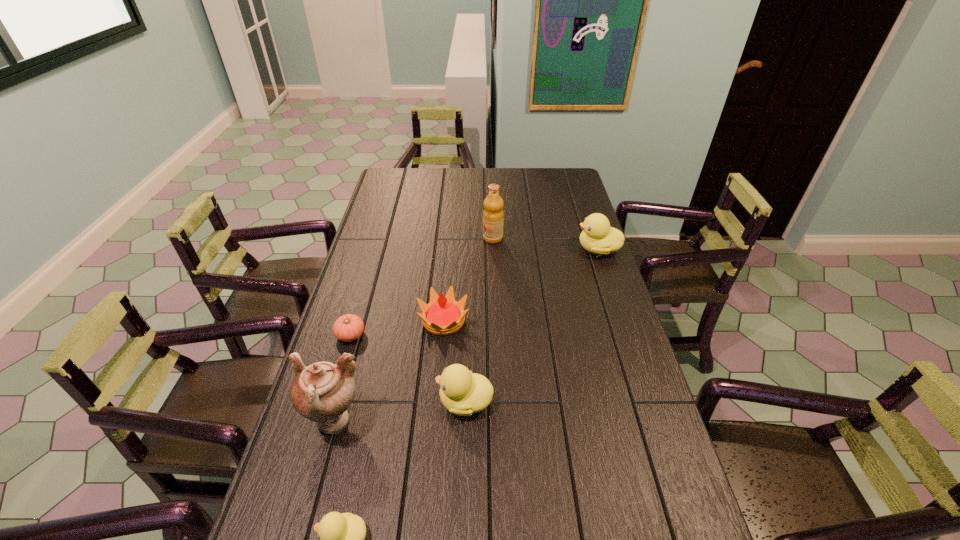
Locate an element on the screen. vacant space that is in between the urn and the rightmost duckling is located at coordinates (467, 336).

Where is `unoccupied position between the second tallest duckling and the urn`? unoccupied position between the second tallest duckling and the urn is located at coordinates (400, 411).

Find the location of a particular element. vacant region between the urn and the second tallest duckling is located at coordinates (400, 411).

Locate an element on the screen. Image resolution: width=960 pixels, height=540 pixels. free area in between the second farthest duckling and the rightmost object is located at coordinates (532, 325).

This screenshot has width=960, height=540. I want to click on free point between the urn and the fruit juice, so click(x=414, y=330).

You are a GUI agent. You are given a task and a screenshot of the screen. Output one action in this format:
    pyautogui.click(x=<x>, y=<y>)
    Task: Click on the vacant space that is in between the second tallest duckling and the fruit juice
    Image resolution: width=960 pixels, height=540 pixels.
    Given the screenshot: What is the action you would take?
    pyautogui.click(x=479, y=320)

Locate an element on the screen. This screenshot has height=540, width=960. unoccupied position between the farthest duckling and the tomato is located at coordinates (474, 292).

Locate an element on the screen. vacant space that is in between the crown and the urn is located at coordinates (389, 372).

Where is `empty space between the tomato and the crown`? The image size is (960, 540). empty space between the tomato and the crown is located at coordinates (397, 328).

Where is `object identified as the fifth closest to the shortest object`? The width and height of the screenshot is (960, 540). object identified as the fifth closest to the shortest object is located at coordinates pos(493,215).